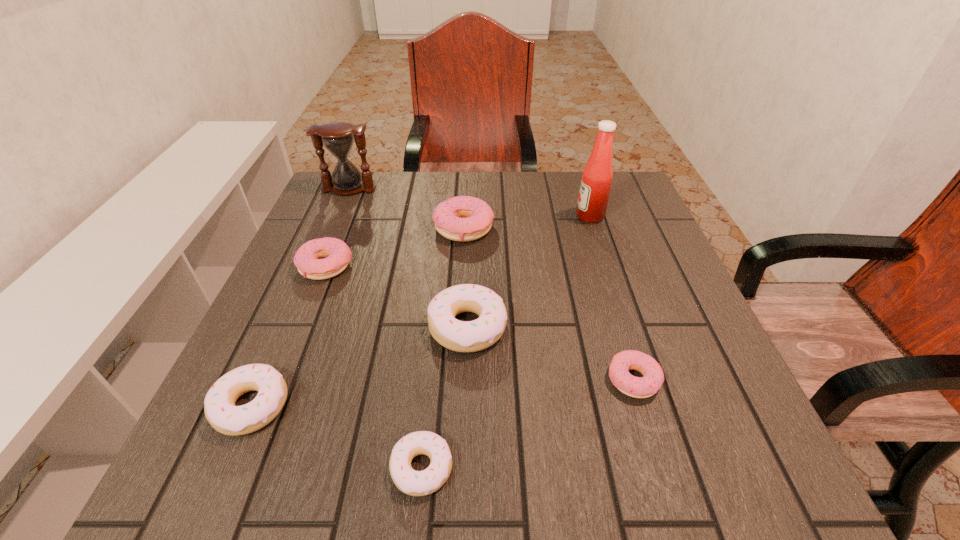
Locate an element on the screen. The height and width of the screenshot is (540, 960). white doughnut that is the closest to the smallest white doughnut is located at coordinates (470, 336).

Locate an element on the screen. Image resolution: width=960 pixels, height=540 pixels. the third closest white doughnut relative to the smallest pink doughnut is located at coordinates (219, 405).

Identify the location of free space that satisfies the following two spatial constraints: 1. on the back side of the smallest white doughnut; 2. on the right side of the farthest white doughnut. (436, 327).

The image size is (960, 540). In order to click on free space that satisfies the following two spatial constraints: 1. on the front side of the hourglass; 2. on the left side of the second pink doughnut from right to left in this screenshot , I will do `click(332, 228)`.